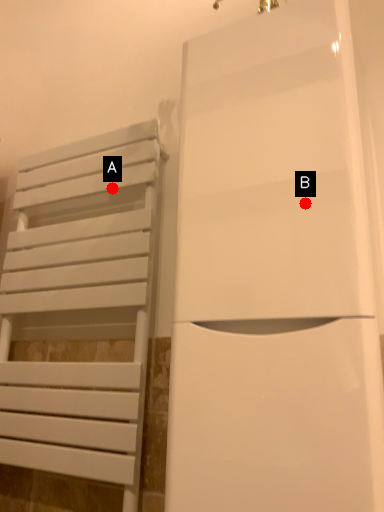
Question: Two points are circled on the image, labeled by A and B beside each circle. Which point is farther to the camera?

Choices:
 (A) A is further
 (B) B is further

Answer: (A)